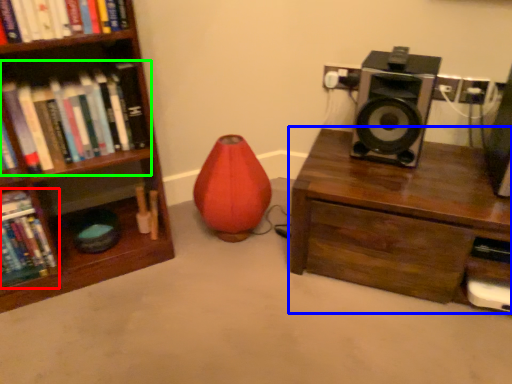
Question: Which object is positioned closest to book (highlighted by a red box)? Select from desk (highlighted by a blue box) and book (highlighted by a green box).

Choices:
 (A) desk
 (B) book

Answer: (B)